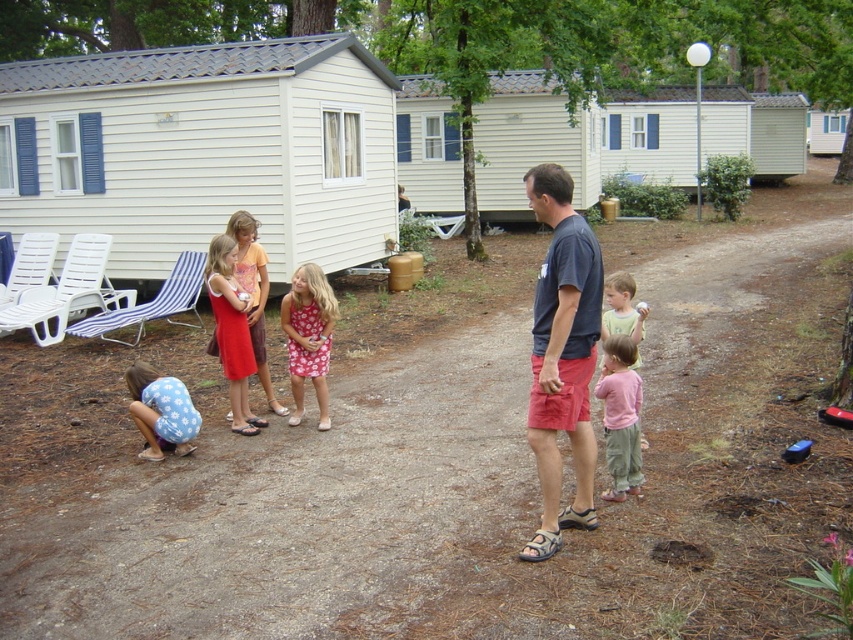
Question: Which of these objects is positioned closest to the dark gray t-shirt at center?

Choices:
 (A) pink floral dress at center
 (B) matte red dress at center
 (C) pink cotton shirt at center
 (D) pink cotton shirt at right

Answer: (C)

Question: Which object appears farthest from the camera in this image?

Choices:
 (A) pink cotton shirt at right
 (B) pink floral dress at center
 (C) matte red dress at center

Answer: (B)

Question: Does pink floral dress at center appear on the right side of pink cotton shirt at center?

Choices:
 (A) yes
 (B) no

Answer: (B)

Question: Is pink cotton shirt at center thinner than pink cotton shirt at right?

Choices:
 (A) yes
 (B) no

Answer: (A)

Question: Which point appears farthest from the camera in this image?

Choices:
 (A) (331, 324)
 (B) (236, 403)

Answer: (A)

Question: Is dark gray t-shirt at center to the right of pink cotton shirt at center from the viewer's perspective?

Choices:
 (A) no
 (B) yes

Answer: (A)